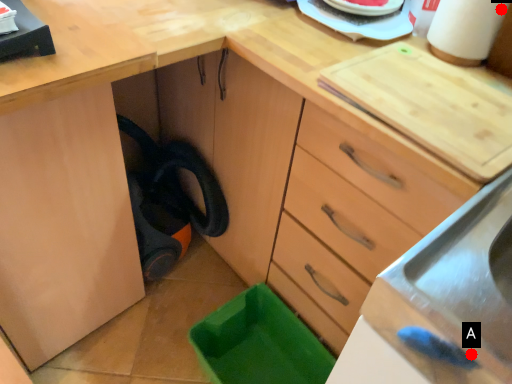
Question: Two points are circled on the image, labeled by A and B beside each circle. Which point appears farthest from the camera in this image?

Choices:
 (A) A is further
 (B) B is further

Answer: (B)